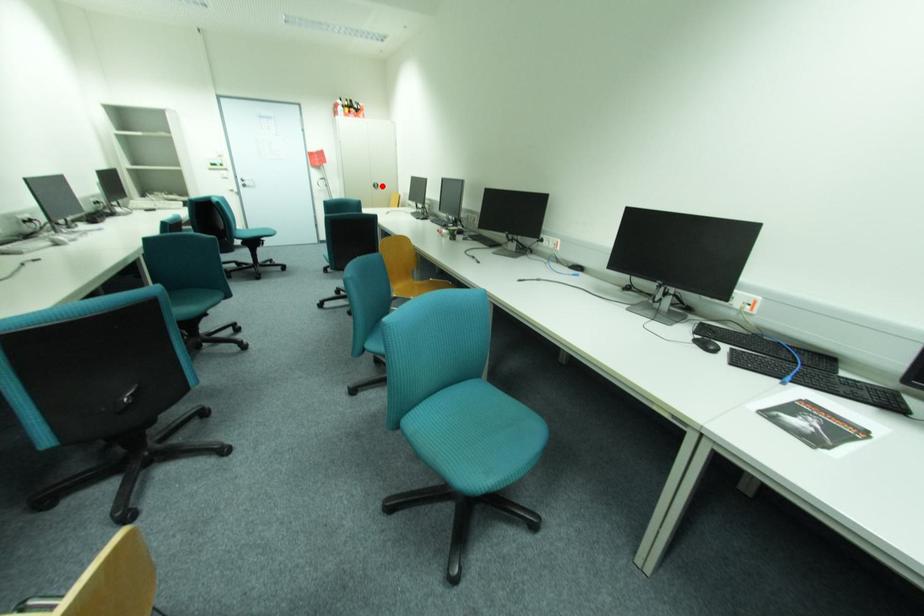
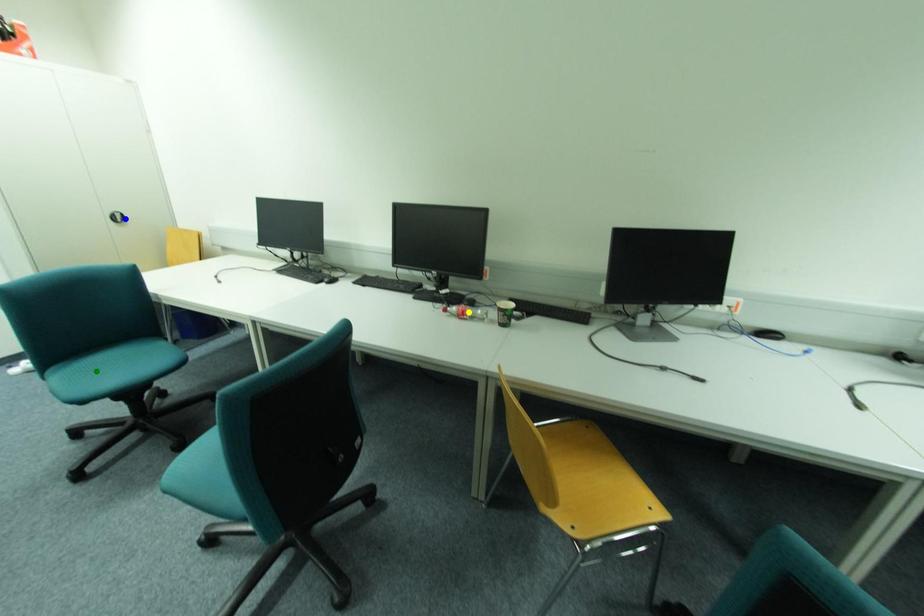
Question: I am providing you with two images of the same scene from different viewpoints. A red point is marked on the first image. You are given multiple points on the second image. Which spot in image 2 lines up with the point in image 1?

Choices:
 (A) blue point
 (B) yellow point
 (C) green point

Answer: (A)